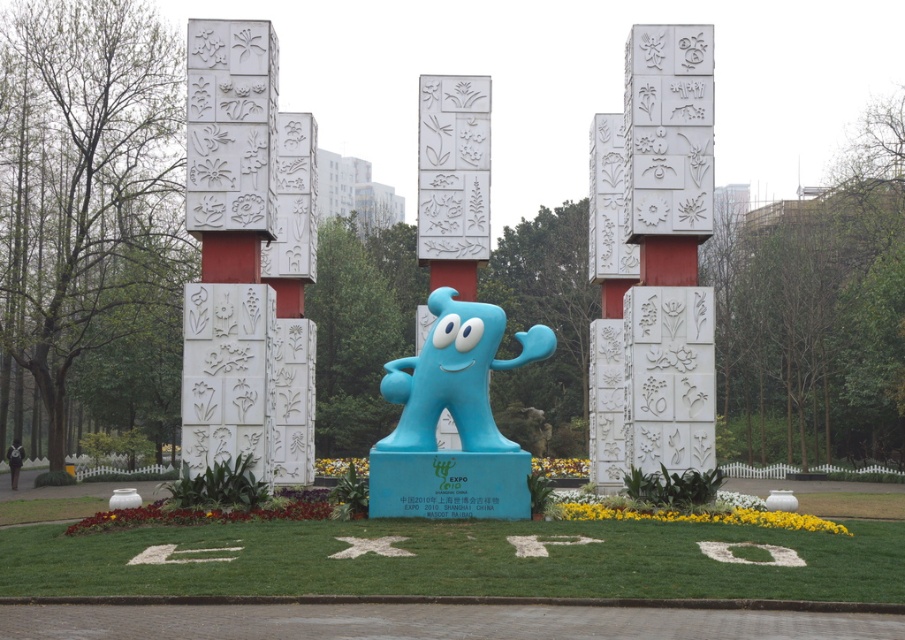
Question: Can you confirm if blue rubber statue at center is smaller than white textured stone pillar at left?

Choices:
 (A) yes
 (B) no

Answer: (A)

Question: Which point appears farthest from the camera in this image?

Choices:
 (A) (665, 180)
 (B) (215, 129)

Answer: (A)

Question: Can you confirm if blue rubber statue at center is bigger than white textured stone pillar at left?

Choices:
 (A) yes
 (B) no

Answer: (B)

Question: In this image, where is blue rubber statue at center located relative to white stone pillars at center?

Choices:
 (A) left
 (B) right

Answer: (A)

Question: Which point is farther to the camera?

Choices:
 (A) (646, 436)
 (B) (656, 593)
 (C) (467, 408)

Answer: (A)

Question: Which object appears closest to the camera in this image?

Choices:
 (A) blue rubber statue at center
 (B) white stone pillars at center

Answer: (A)